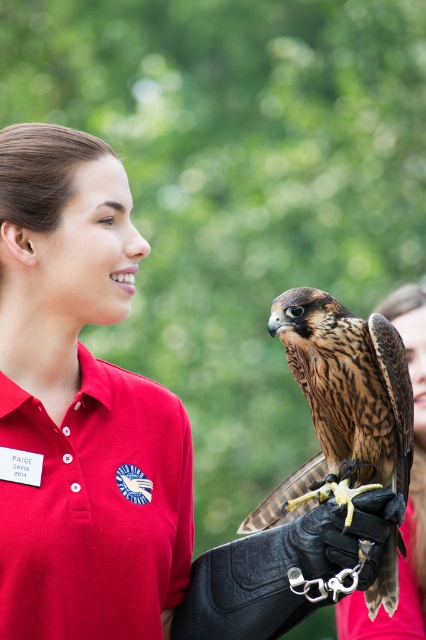
You are a photographer at the event and want to capture a closeup of the brown speckled feathers at center without the matte red polo shirt at center appearing in the background. Given that your camera has a depth of field setting that can blur objects beyond 16 inches away, will this setup work?

The distance between the matte red polo shirt at center and brown speckled feathers at center is 15.06 inches. Since the depth of field blurs objects beyond 16 inches away, the polo shirt will still be in focus and visible in the background. Therefore, the setup won not work as intended.

You are a photographer at the event and need to capture a closeup of the brown speckled feathers at center. Where exactly should you focus your camera?

Focus your camera at point [342,401] to capture the brown speckled feathers at center.